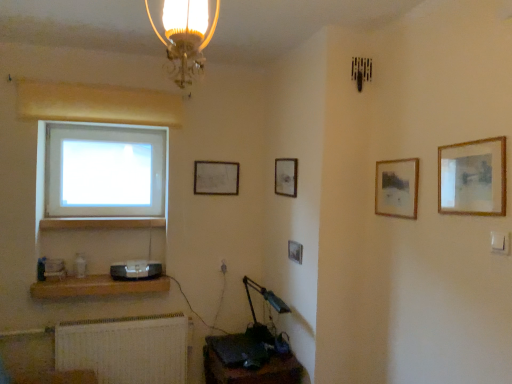
Question: Would you say matte silver picture frame at upper center, which ranks as the 5th picture frame in right-to-left order, is outside satin black speaker at lower left?

Choices:
 (A) yes
 (B) no

Answer: (A)

Question: Would you consider matte silver picture frame at upper center, which ranks as the 5th picture frame in right-to-left order, to be distant from satin black speaker at lower left?

Choices:
 (A) no
 (B) yes

Answer: (A)

Question: Can you confirm if matte silver picture frame at upper center, which appears as the 1th picture frame when viewed from the back, is smaller than satin black speaker at lower left?

Choices:
 (A) no
 (B) yes

Answer: (B)

Question: Can you confirm if matte silver picture frame at upper center, which ranks as the 5th picture frame in right-to-left order, is taller than satin black speaker at lower left?

Choices:
 (A) yes
 (B) no

Answer: (A)

Question: Does matte silver picture frame at upper center, the first picture frame from the left, have a lesser height compared to satin black speaker at lower left?

Choices:
 (A) yes
 (B) no

Answer: (B)

Question: In terms of size, does brown wooden shelf at lower left appear bigger or smaller than transparent glass window at left?

Choices:
 (A) small
 (B) big

Answer: (A)

Question: From the image's perspective, is brown wooden shelf at lower left located above or below transparent glass window at left?

Choices:
 (A) below
 (B) above

Answer: (A)

Question: Is brown wooden shelf at lower left situated inside transparent glass window at left or outside?

Choices:
 (A) inside
 (B) outside

Answer: (B)

Question: Considering the positions of point (70, 291) and point (74, 203), is point (70, 291) closer or farther from the camera than point (74, 203)?

Choices:
 (A) farther
 (B) closer

Answer: (B)

Question: Considering the positions of wooden picture frame at center, which ranks as the third picture frame in left-to-right order, and metallic blue table lamp at lower center in the image, is wooden picture frame at center, which ranks as the third picture frame in left-to-right order, bigger or smaller than metallic blue table lamp at lower center?

Choices:
 (A) big
 (B) small

Answer: (B)

Question: Considering the positions of wooden picture frame at center, the third picture frame when ordered from right to left, and metallic blue table lamp at lower center in the image, is wooden picture frame at center, the third picture frame when ordered from right to left, taller or shorter than metallic blue table lamp at lower center?

Choices:
 (A) tall
 (B) short

Answer: (B)

Question: Is wooden picture frame at center, the third picture frame when ordered from right to left, wider or thinner than metallic blue table lamp at lower center?

Choices:
 (A) thin
 (B) wide

Answer: (A)

Question: From a real-world perspective, is wooden picture frame at center, which is counted as the 3th picture frame, starting from the front, above or below metallic blue table lamp at lower center?

Choices:
 (A) below
 (B) above

Answer: (B)

Question: Would you say wooden picture frame at upper center, which is counted as the 2th picture frame, starting from the back, is to the left or to the right of wooden frame at upper right, which is the fifth picture frame from left to right, in the picture?

Choices:
 (A) left
 (B) right

Answer: (A)

Question: Considering their positions, is wooden picture frame at upper center, positioned as the 2th picture frame in left-to-right order, located in front of or behind wooden frame at upper right, the 5th picture frame when ordered from back to front?

Choices:
 (A) behind
 (B) front

Answer: (A)